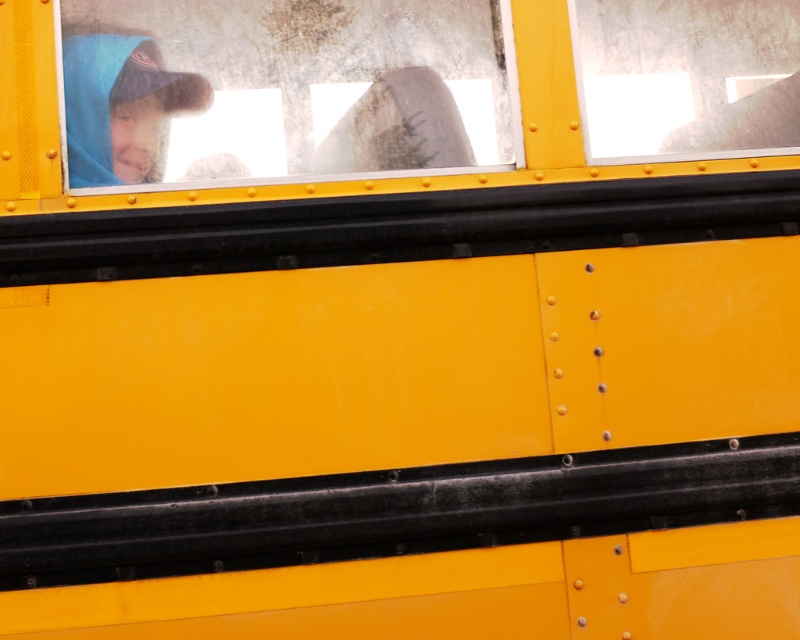
Can you confirm if transparent glass window at upper left is thinner than transparent glass window at upper right?

In fact, transparent glass window at upper left might be wider than transparent glass window at upper right.

Between transparent glass window at upper left and transparent glass window at upper right, which one is positioned higher?

transparent glass window at upper right

Which is in front, point (62, 68) or point (784, 61)?

Point (62, 68)

Where is `transparent glass window at upper left`? transparent glass window at upper left is located at coordinates (284, 88).

Can you confirm if transparent glass window at upper left is smaller than blue fleece at upper left?

No.

Can you confirm if transparent glass window at upper left is positioned below blue fleece at upper left?

Incorrect, transparent glass window at upper left is not positioned below blue fleece at upper left.

Identify the location of transparent glass window at upper left. The width and height of the screenshot is (800, 640). (284, 88).

The width and height of the screenshot is (800, 640). What do you see at coordinates (686, 76) in the screenshot?
I see `transparent glass window at upper right` at bounding box center [686, 76].

Who is lower down, transparent glass window at upper right or blue fleece at upper left?

blue fleece at upper left is below.

Where is `transparent glass window at upper right`? Image resolution: width=800 pixels, height=640 pixels. transparent glass window at upper right is located at coordinates (686, 76).